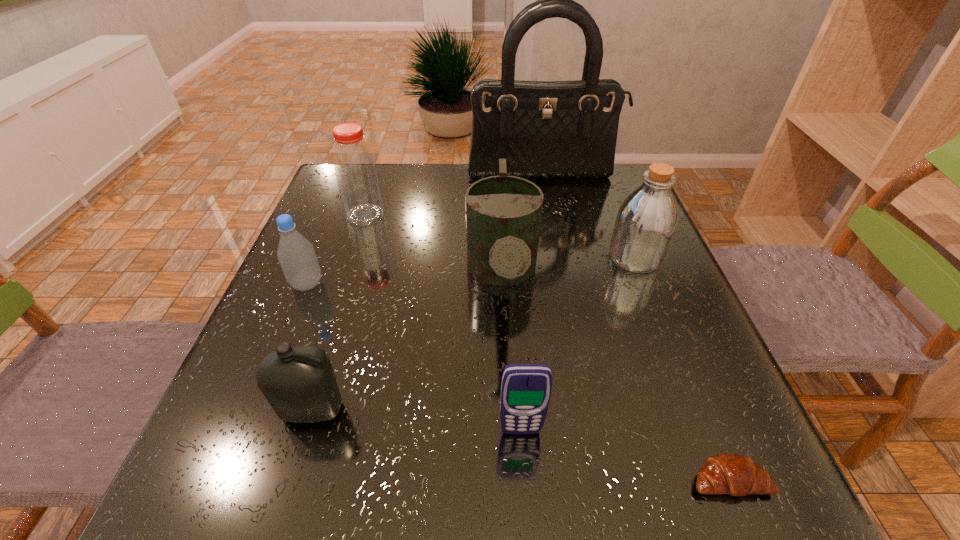
Where is `the tallest object`? Image resolution: width=960 pixels, height=540 pixels. the tallest object is located at coordinates (544, 129).

Where is `handbag`? This screenshot has width=960, height=540. handbag is located at coordinates (544, 129).

Where is `the farthest bottle`? This screenshot has height=540, width=960. the farthest bottle is located at coordinates (356, 174).

Where is `the rightmost bottle`? the rightmost bottle is located at coordinates (646, 221).

This screenshot has width=960, height=540. I want to click on watering can, so click(503, 213).

Locate an element on the screen. The image size is (960, 540). the nearest bottle is located at coordinates (299, 383).

This screenshot has height=540, width=960. I want to click on cellular telephone, so click(x=525, y=388).

I want to click on the nearest object, so click(736, 475).

You are a GUI agent. You are given a task and a screenshot of the screen. Output one action in this format:
    pyautogui.click(x=<x>, y=<y>)
    Task: Click on the crescent roll
    
    Given the screenshot: What is the action you would take?
    pyautogui.click(x=736, y=475)

Where is `blank area located with an open clasp on the front of the tallest object`? blank area located with an open clasp on the front of the tallest object is located at coordinates (551, 219).